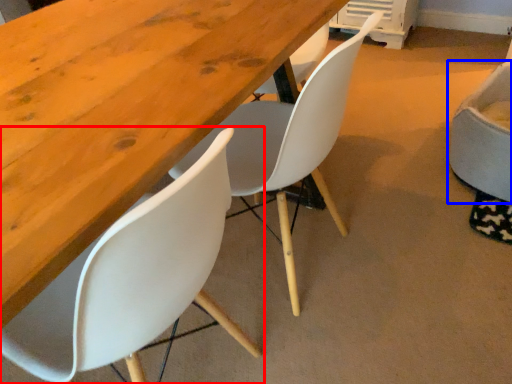
Question: Which of the following is the farthest to the observer, chair (highlighted by a red box) or chair (highlighted by a blue box)?

Choices:
 (A) chair
 (B) chair

Answer: (B)